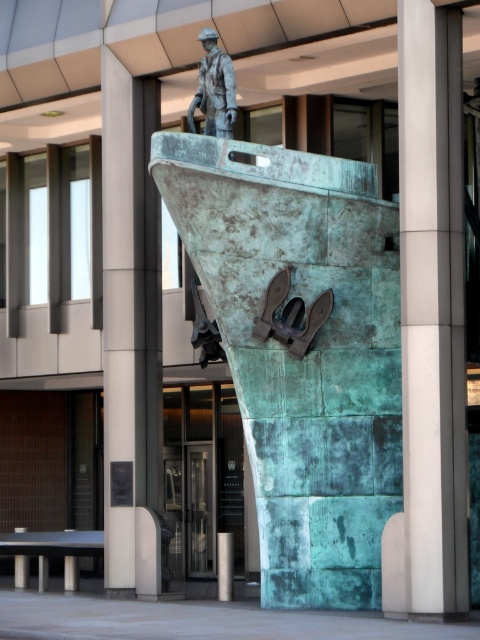
Is smooth gray concrete pillar at center to the left of green patina stone at upper center from the viewer's perspective?

In fact, smooth gray concrete pillar at center is to the right of green patina stone at upper center.

Is point (406, 205) positioned after point (133, 298)?

No, it is not.

Does point (443, 547) come in front of point (132, 500)?

Yes, it is.

Find the location of `smooth gray concrete pillar at center`. smooth gray concrete pillar at center is located at coordinates (430, 324).

Is green patina stone at upper center to the right of bronze statue at upper center from the viewer's perspective?

Incorrect, green patina stone at upper center is not on the right side of bronze statue at upper center.

Does green patina stone at upper center come behind bronze statue at upper center?

Yes, green patina stone at upper center is behind bronze statue at upper center.

The height and width of the screenshot is (640, 480). I want to click on green patina stone at upper center, so click(x=129, y=314).

Which is above, smooth gray concrete pillar at center or bronze statue at upper center?

bronze statue at upper center is higher up.

Can you confirm if smooth gray concrete pillar at center is bigger than bronze statue at upper center?

Actually, smooth gray concrete pillar at center might be smaller than bronze statue at upper center.

Does point (435, 72) lie behind point (207, 52)?

No.

At what (x,y) coordinates should I click in order to perform the action: click on smooth gray concrete pillar at center. Please return your answer as a coordinate pair (x, y). Looking at the image, I should click on pyautogui.click(x=430, y=324).